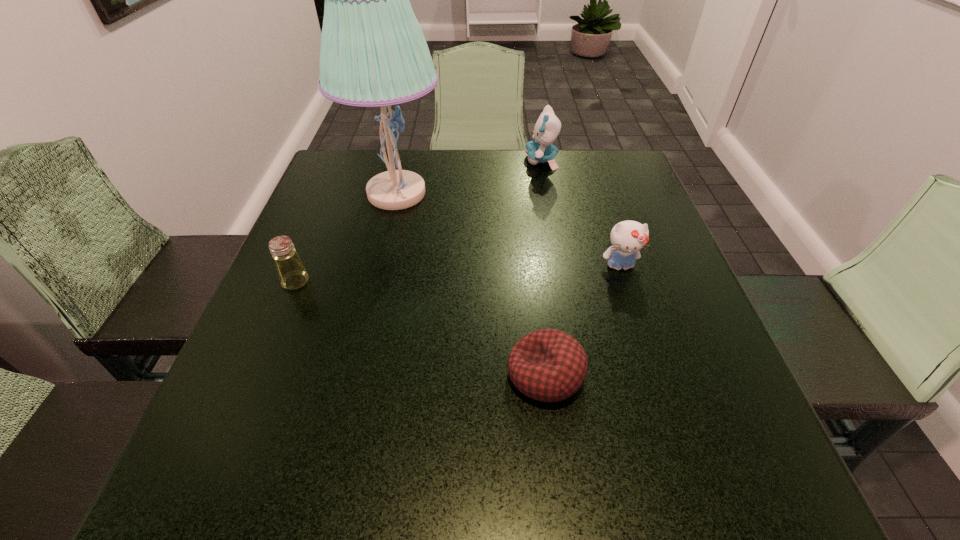
At what (x,y) coordinates should I click in order to perform the action: click on object that is at the right edge. Please return your answer as a coordinate pair (x, y). This screenshot has height=540, width=960. Looking at the image, I should click on (628, 238).

The height and width of the screenshot is (540, 960). In order to click on object positioned at the far left corner in this screenshot , I will do `click(373, 52)`.

Image resolution: width=960 pixels, height=540 pixels. Identify the location of free space at the far edge of the desktop. (541, 193).

Where is `free space at the near edge of the desktop`? free space at the near edge of the desktop is located at coordinates (301, 504).

Find the location of a particular element. This screenshot has height=540, width=960. free location at the left edge is located at coordinates (321, 359).

At what (x,y) coordinates should I click in order to perform the action: click on vacant space at the right edge of the desktop. Please return your answer as a coordinate pair (x, y). Looking at the image, I should click on 652,220.

Identify the location of free space at the far left corner. The height and width of the screenshot is (540, 960). (336, 148).

Image resolution: width=960 pixels, height=540 pixels. What are the coordinates of `vacant space at the far right corner of the desktop` in the screenshot? It's located at (593, 151).

Identify the location of blank space at the near right corner of the desktop. (675, 457).

Where is `free space between the saltshaker and the nearer kitten`? free space between the saltshaker and the nearer kitten is located at coordinates (458, 274).